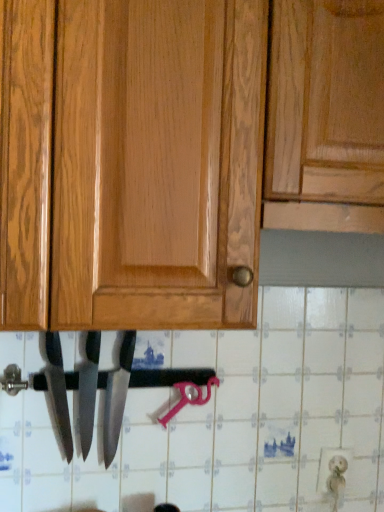
Question: Would you say polished silver knife at center, which is the second knife in left-to-right order, is to the left or to the right of polished silver knife at center, the first knife positioned from the right, in the picture?

Choices:
 (A) right
 (B) left

Answer: (B)

Question: Is polished silver knife at center, which is the second knife in left-to-right order, in front of or behind polished silver knife at center, positioned as the 3th knife in left-to-right order, in the image?

Choices:
 (A) front
 (B) behind

Answer: (B)

Question: Which of these objects is positioned closest to the polished silver knife at center, which is counted as the 2th knife, starting from the right?

Choices:
 (A) polished silver knife at center, the first knife positioned from the right
 (B) polished silver knife at lower center, acting as the third knife starting from the right

Answer: (A)

Question: Considering the real-world distances, which object is farthest from the polished silver knife at center, which is counted as the 2th knife, starting from the right?

Choices:
 (A) polished silver knife at lower center, acting as the 1th knife starting from the left
 (B) polished silver knife at center, the first knife positioned from the right

Answer: (A)